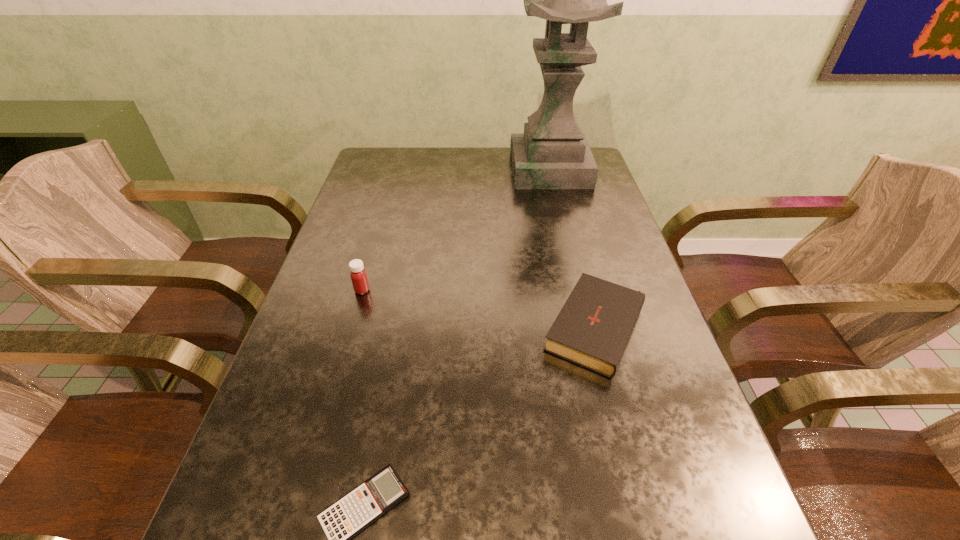
Find the location of a particular element. This screenshot has height=540, width=960. sculpture is located at coordinates (552, 153).

At what (x,y) coordinates should I click in order to perform the action: click on the tallest object. Please return your answer as a coordinate pair (x, y). The width and height of the screenshot is (960, 540). Looking at the image, I should click on (552, 153).

Locate an element on the screen. This screenshot has height=540, width=960. the leftmost object is located at coordinates click(x=358, y=275).

Locate an element on the screen. medicine is located at coordinates (358, 275).

You are a GUI agent. You are given a task and a screenshot of the screen. Output one action in this format:
    pyautogui.click(x=<x>, y=<y>)
    Task: Click on the second shortest object
    The width and height of the screenshot is (960, 540).
    Given the screenshot: What is the action you would take?
    pyautogui.click(x=593, y=328)

Where is `free region located at the front opening of the sculpture`? free region located at the front opening of the sculpture is located at coordinates (445, 170).

At what (x,y) coordinates should I click in order to perform the action: click on vacant position located at the front opening of the sculpture. Please return your answer as a coordinate pair (x, y). Looking at the image, I should click on 491,170.

Find the location of a particular element. This screenshot has width=960, height=540. vacant space located 0.210m at the front opening of the sculpture is located at coordinates (448, 170).

Where is `free space located on the right of the medicine`? free space located on the right of the medicine is located at coordinates (446, 291).

The width and height of the screenshot is (960, 540). I want to click on vacant space positioned on the back of the Bible, so click(564, 200).